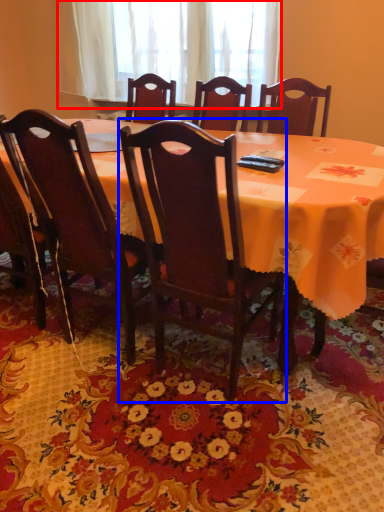
Question: Which object is further to the camera taking this photo, curtain (highlighted by a red box) or chair (highlighted by a blue box)?

Choices:
 (A) curtain
 (B) chair

Answer: (A)